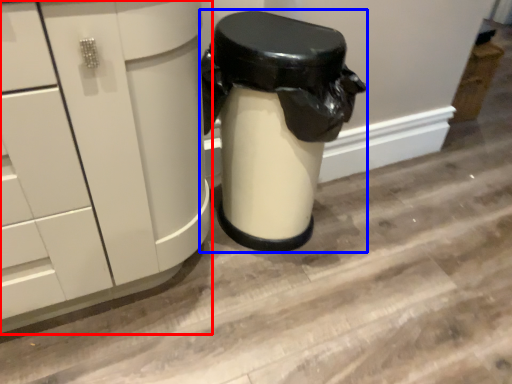
Question: Which point is further to the camera, cabinetry (highlighted by a red box) or garbage (highlighted by a blue box)?

Choices:
 (A) cabinetry
 (B) garbage

Answer: (B)